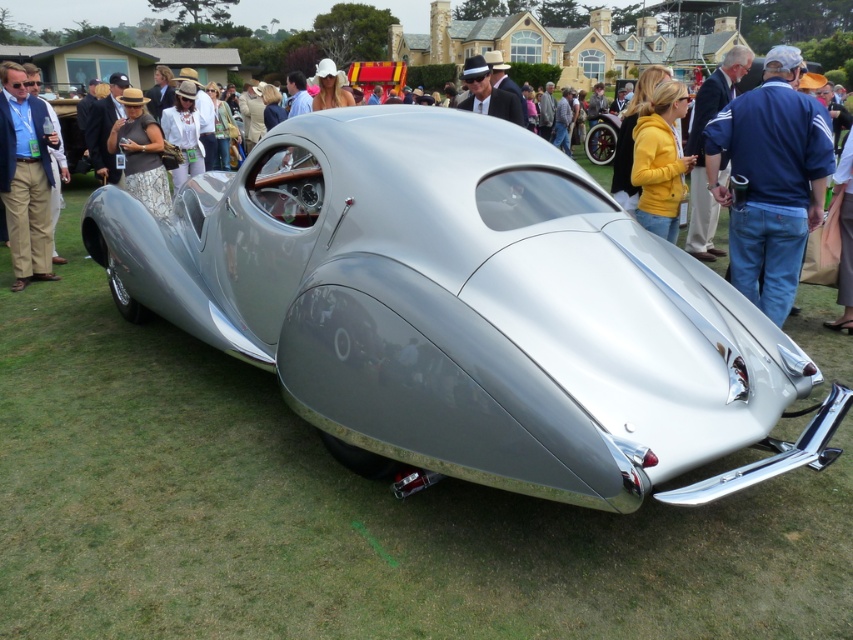
You are a photographer at the classic car event. You want to take a photo of the polished silver car at center and the brushed metal jacket at left. Which object should you focus on first if you want to capture both in a single frame without moving the camera?

The polished silver car at center is not as tall as the brushed metal jacket at left, so you should focus on the brushed metal jacket at left first to ensure both objects are in the frame.

Consider the image. You are standing at the back of the vintage car event. You see two points in the image, point (358, 392) and point (810, 195). Which point is closer to you?

Point (810, 195) is further away from you than point (358, 392), so the closer point is point (358, 392).

You are a photographer positioned in front of the vintage car at the event. You want to take a photo that includes both the blue denim jeans at right and the brushed metal jacket at left. Which object should you adjust your camera angle to focus on first to ensure both are in frame?

The blue denim jeans at right is closer to the viewer than the brushed metal jacket at left, so you should focus on the blue denim jeans at right first to ensure both are in frame.